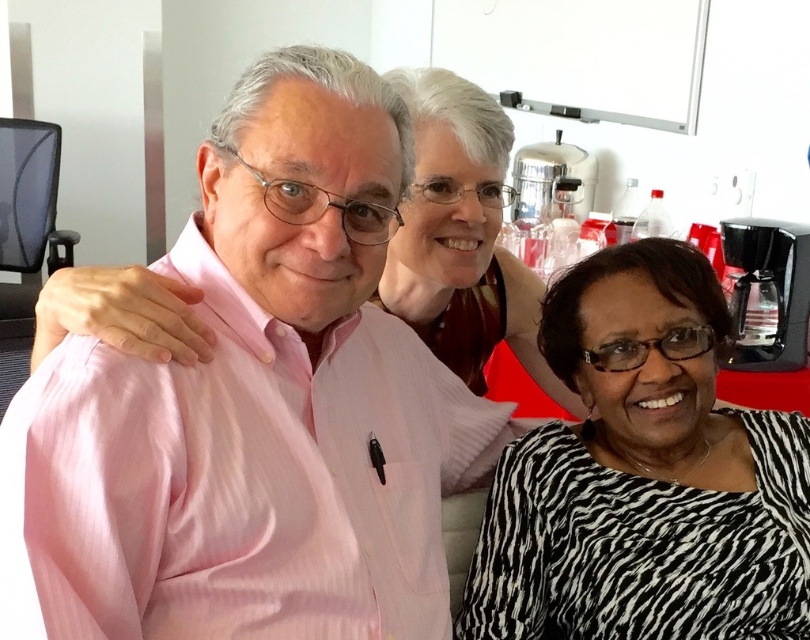
Question: Which object appears farthest from the camera in this image?

Choices:
 (A) zebra-patterned blouse at center
 (B) pink striped shirt at left

Answer: (A)

Question: Where is pink striped shirt at left located in relation to zebra-patterned blouse at center in the image?

Choices:
 (A) below
 (B) above

Answer: (B)

Question: Can you confirm if pink striped shirt at left is bigger than zebra-patterned blouse at center?

Choices:
 (A) yes
 (B) no

Answer: (A)

Question: In this image, where is pink striped shirt at left located relative to zebra-patterned blouse at center?

Choices:
 (A) below
 (B) above

Answer: (B)